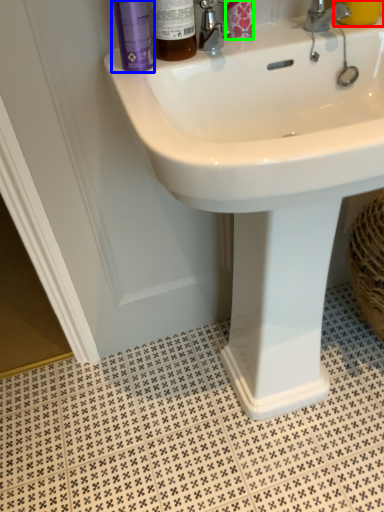
Question: Which object is the closest to the liquid (highlighted by a red box)? Choose among these: mouthwash (highlighted by a blue box) or toiletry (highlighted by a green box).

Choices:
 (A) mouthwash
 (B) toiletry

Answer: (B)